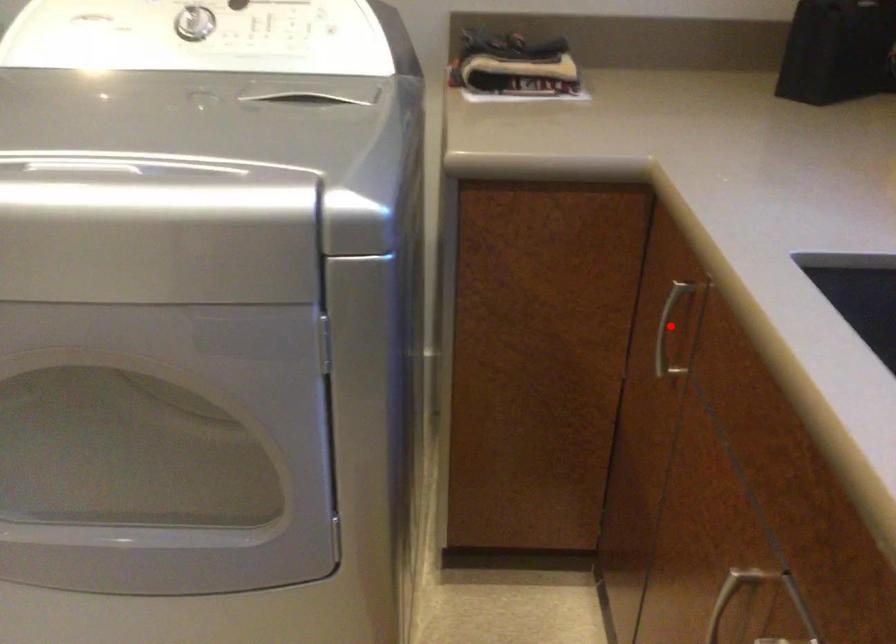
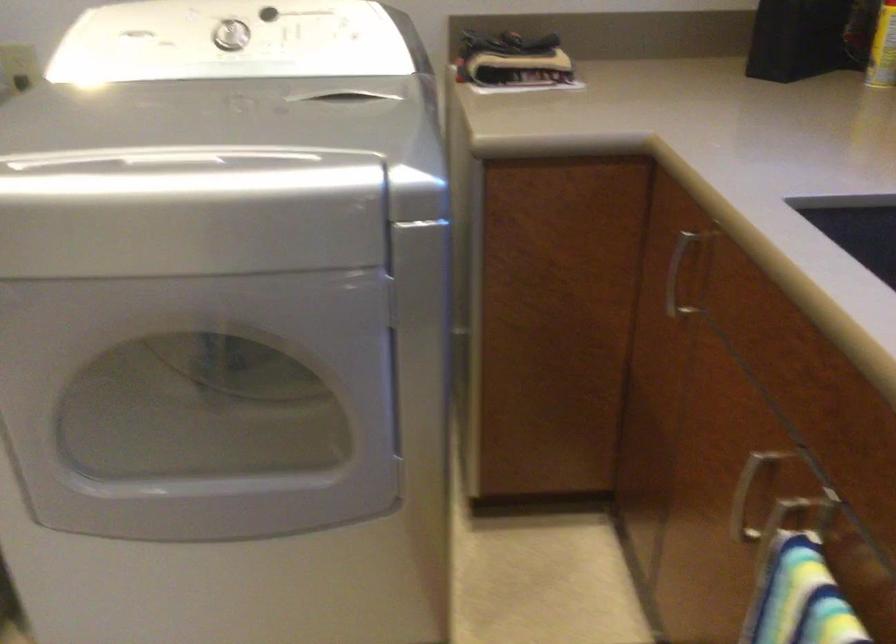
The point at the highlighted location is marked in the first image. Where is the corresponding point in the second image?

(677, 275)